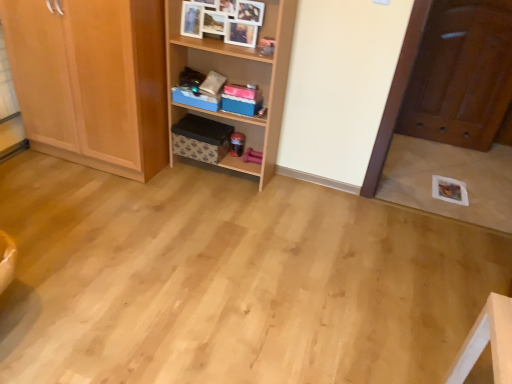
The width and height of the screenshot is (512, 384). What are the coordinates of `vacant space underneath shiny brown door at right (from a real-world perspective)` in the screenshot? It's located at (453, 146).